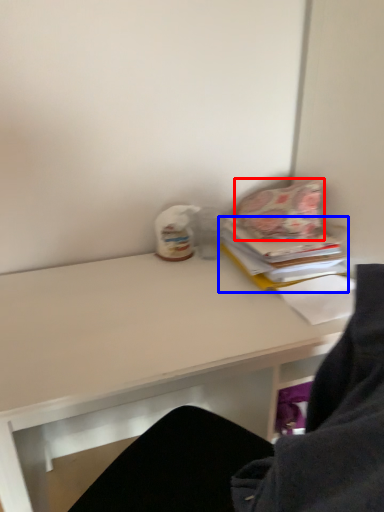
Question: Which object is closer to the camera taking this photo, pillow (highlighted by a red box) or paperback book (highlighted by a blue box)?

Choices:
 (A) pillow
 (B) paperback book

Answer: (B)